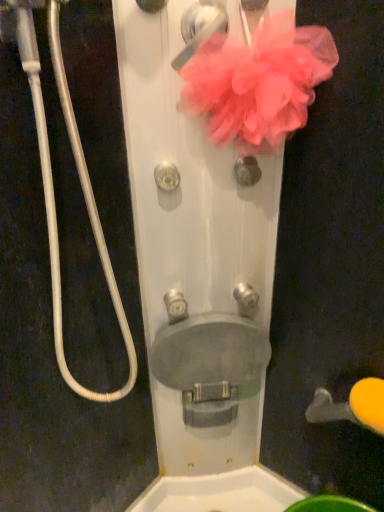
Question: Is pink fabric door handle at upper center, positioned as the 1th door handle in top-to-bottom order, to the right of yellow rubber door handle at lower right, which is counted as the first door handle, starting from the right, from the viewer's perspective?

Choices:
 (A) no
 (B) yes

Answer: (A)

Question: Does pink fabric door handle at upper center, the 2th door handle in the right-to-left sequence, have a lesser height compared to yellow rubber door handle at lower right, acting as the second door handle starting from the top?

Choices:
 (A) no
 (B) yes

Answer: (A)

Question: Is yellow rubber door handle at lower right, which is counted as the first door handle, starting from the right, completely or partially inside pink fabric door handle at upper center, which appears as the first door handle when viewed from the left?

Choices:
 (A) no
 (B) yes

Answer: (A)

Question: Can you confirm if pink fabric door handle at upper center, the first door handle viewed from the front, is smaller than yellow rubber door handle at lower right, positioned as the first door handle in back-to-front order?

Choices:
 (A) no
 (B) yes

Answer: (B)

Question: Is pink fabric door handle at upper center, the 2th door handle in the right-to-left sequence, placed right next to yellow rubber door handle at lower right, the second door handle in the left-to-right sequence?

Choices:
 (A) no
 (B) yes

Answer: (A)

Question: From a real-world perspective, is pink fabric door handle at upper center, the 2th door handle in the right-to-left sequence, above or below satin silver knob at center, the 1th knob viewed from the right?

Choices:
 (A) above
 (B) below

Answer: (A)

Question: In terms of width, does pink fabric door handle at upper center, positioned as the 1th door handle in top-to-bottom order, look wider or thinner when compared to satin silver knob at center, the 4th knob from the left?

Choices:
 (A) wide
 (B) thin

Answer: (A)

Question: Is pink fabric door handle at upper center, the first door handle viewed from the front, bigger or smaller than satin silver knob at center, the 1th knob viewed from the right?

Choices:
 (A) small
 (B) big

Answer: (B)

Question: Is pink fabric door handle at upper center, the second door handle from the back, taller or shorter than satin silver knob at center, arranged as the 2th knob when ordered from the bottom?

Choices:
 (A) short
 (B) tall

Answer: (B)

Question: Is yellow rubber door handle at lower right, the second door handle in the left-to-right sequence, bigger or smaller than satin silver knob at center, arranged as the 2th knob when ordered from the bottom?

Choices:
 (A) small
 (B) big

Answer: (B)

Question: Considering the positions of yellow rubber door handle at lower right, which is counted as the first door handle, starting from the right, and satin silver knob at center, the 1th knob viewed from the right, in the image, is yellow rubber door handle at lower right, which is counted as the first door handle, starting from the right, taller or shorter than satin silver knob at center, the 1th knob viewed from the right,?

Choices:
 (A) short
 (B) tall

Answer: (A)

Question: In the image, is yellow rubber door handle at lower right, marked as the 2th door handle in a front-to-back arrangement, positioned in front of or behind satin silver knob at center, the 1th knob viewed from the right?

Choices:
 (A) front
 (B) behind

Answer: (A)

Question: From the image's perspective, is yellow rubber door handle at lower right, positioned as the first door handle in back-to-front order, positioned above or below satin silver knob at center, the 3th knob positioned from the top?

Choices:
 (A) above
 (B) below

Answer: (B)

Question: In terms of size, does pink fabric door handle at upper center, the 2th door handle positioned from the bottom, appear bigger or smaller than metallic silver knob at center, which is the fourth knob from right to left?

Choices:
 (A) big
 (B) small

Answer: (A)

Question: Considering the relative positions of pink fabric door handle at upper center, the first door handle viewed from the front, and metallic silver knob at center, which is the 1th knob in left-to-right order, in the image provided, is pink fabric door handle at upper center, the first door handle viewed from the front, to the left or to the right of metallic silver knob at center, which is the 1th knob in left-to-right order,?

Choices:
 (A) right
 (B) left

Answer: (A)